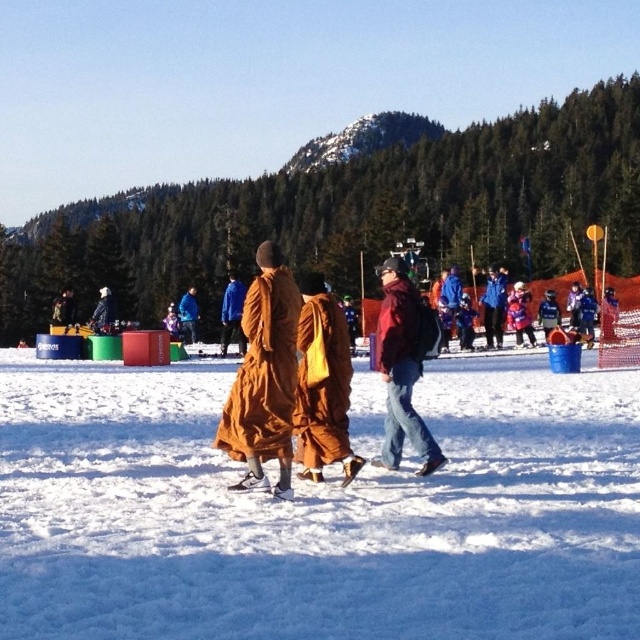
Question: From the image, what is the correct spatial relationship of white fluffy snow at center in relation to brown fabric robe at center?

Choices:
 (A) below
 (B) above

Answer: (A)

Question: Which of the following is the farthest from the observer?

Choices:
 (A) matte red jacket at center
 (B) brown fabric robe at center
 (C) white fluffy snow at center

Answer: (A)

Question: Does white fluffy snow at center appear on the right side of brown fabric robe at center?

Choices:
 (A) yes
 (B) no

Answer: (A)

Question: Which point is closer to the camera taking this photo?

Choices:
 (A) (288, 413)
 (B) (211, 582)

Answer: (B)

Question: Is brown fabric robe at center to the right of matte red jacket at center from the viewer's perspective?

Choices:
 (A) no
 (B) yes

Answer: (A)

Question: Among these objects, which one is nearest to the camera?

Choices:
 (A) brown fabric robe at center
 (B) matte red jacket at center
 (C) white fluffy snow at center

Answer: (C)